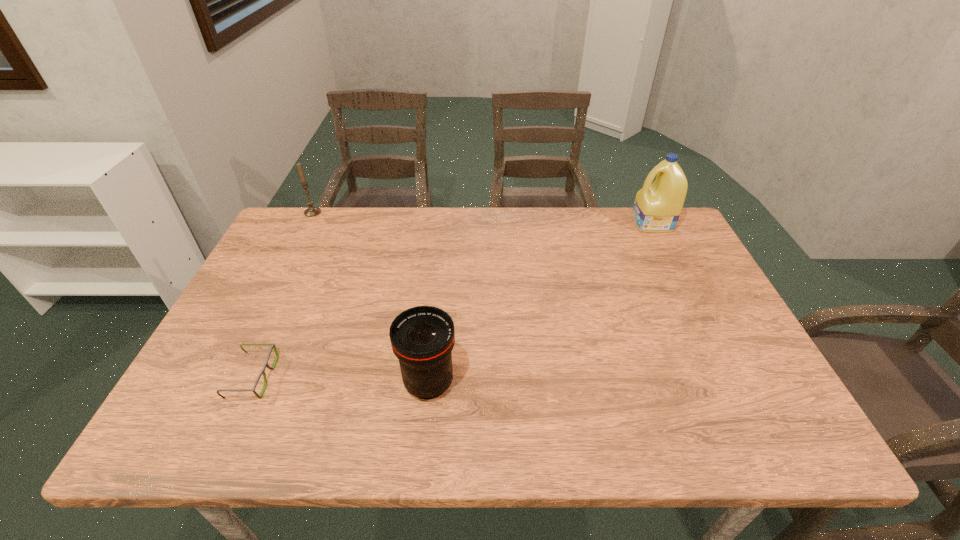
Locate an element on the screen. This screenshot has width=960, height=540. free space between the spectacles and the candle is located at coordinates (282, 295).

I want to click on vacant area that lies between the detergent and the third object from left to right, so click(540, 303).

This screenshot has width=960, height=540. Find the location of `empty space between the candle and the second object from right to left`. empty space between the candle and the second object from right to left is located at coordinates (371, 298).

Locate an element on the screen. vacant space that's between the rightmost object and the candle is located at coordinates [483, 218].

At what (x,y) coordinates should I click in order to perform the action: click on unoccupied position between the third object from left to right and the candle. Please return your answer as a coordinate pair (x, y). Looking at the image, I should click on click(371, 298).

Locate an element on the screen. Image resolution: width=960 pixels, height=540 pixels. vacant area that lies between the candle and the telephoto lens is located at coordinates (371, 298).

Find the location of a particular element. This screenshot has height=540, width=960. object that is the closest one to the tallest object is located at coordinates (422, 337).

Locate an element on the screen. This screenshot has width=960, height=540. object that stands as the third closest to the rightmost object is located at coordinates (272, 345).

I want to click on vacant region that satisfies the following two spatial constraints: 1. on the lens of the spectacles; 2. on the back side of the third object from left to right, so click(251, 383).

Image resolution: width=960 pixels, height=540 pixels. Find the location of `free space that satisfies the following two spatial constraints: 1. on the lens of the second object from right to left; 2. on the right side of the shortest object`. free space that satisfies the following two spatial constraints: 1. on the lens of the second object from right to left; 2. on the right side of the shortest object is located at coordinates (251, 383).